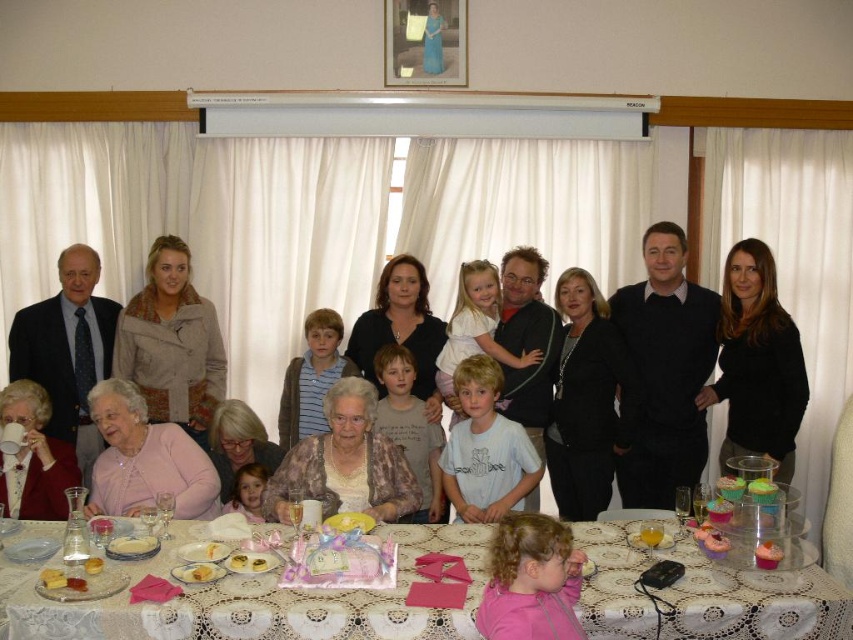
Question: Which object appears closest to the camera in this image?

Choices:
 (A) black sweater at right
 (B) matte black mug at lower left

Answer: (B)

Question: Can you confirm if matte black cake at center is smaller than matte black suit at left?

Choices:
 (A) no
 (B) yes

Answer: (A)

Question: Which object appears farthest from the camera in this image?

Choices:
 (A) white lace tablecloth at lower center
 (B) matte black mug at lower left
 (C) pink fabric at lower center
 (D) beige textured jacket at upper left

Answer: (D)

Question: Can you confirm if matte black suit at left is positioned below floral-patterned dress at center?

Choices:
 (A) no
 (B) yes

Answer: (A)

Question: Among these points, which one is farthest from the camera?

Choices:
 (A) (131, 605)
 (B) (519, 608)

Answer: (A)

Question: Observing the image, what is the correct spatial positioning of black sweater at right in reference to pink fabric at lower center?

Choices:
 (A) right
 (B) left

Answer: (A)